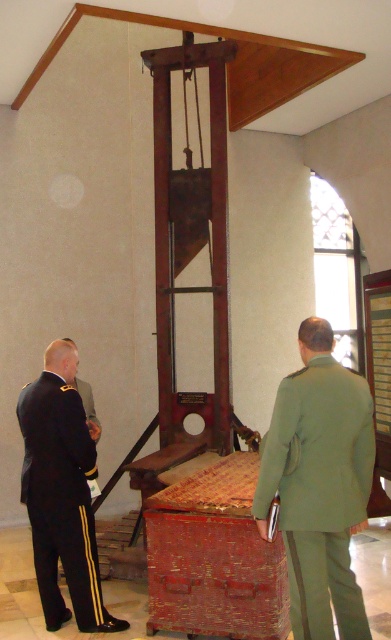
Question: Which point is closer to the camera?

Choices:
 (A) (310, 547)
 (B) (105, 611)

Answer: (A)

Question: Is green uniform at center below black uniform at left?

Choices:
 (A) yes
 (B) no

Answer: (B)

Question: Is green uniform at center below black uniform at left?

Choices:
 (A) no
 (B) yes

Answer: (A)

Question: Which object appears closest to the camera in this image?

Choices:
 (A) green uniform at center
 (B) black uniform at left

Answer: (A)

Question: From the image, what is the correct spatial relationship of green uniform at center in relation to black uniform at left?

Choices:
 (A) above
 (B) below

Answer: (A)